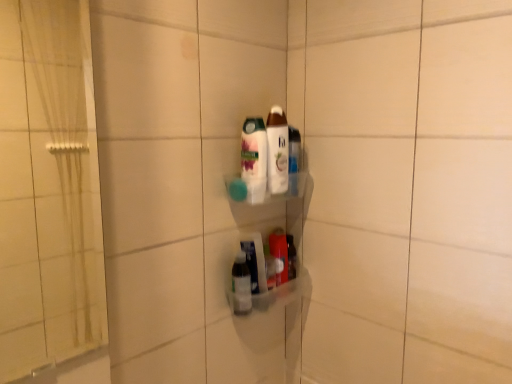
Find the location of a particular element. The image size is (512, 384). white glossy lotion at center, arranged as the 1th bottle when viewed from the top is located at coordinates (277, 151).

Identify the location of white glossy bottle at center, positioned as the third bottle in bottom-to-top order. (254, 159).

Between white glossy lotion at center, arranged as the 1th bottle when viewed from the top, and white glossy bottle at center, arranged as the second bottle when viewed from the top, which one has more height?

white glossy lotion at center, arranged as the 1th bottle when viewed from the top, is taller.

Choose the correct answer: Is white glossy lotion at center, the 4th bottle when ordered from bottom to top, inside white glossy bottle at center, positioned as the third bottle in bottom-to-top order, or outside it?

white glossy lotion at center, the 4th bottle when ordered from bottom to top, cannot be found inside white glossy bottle at center, positioned as the third bottle in bottom-to-top order.

Is white glossy lotion at center, arranged as the 1th bottle when viewed from the top, in front of or behind white glossy bottle at center, arranged as the second bottle when viewed from the top, in the image?

In the image, white glossy lotion at center, arranged as the 1th bottle when viewed from the top, appears behind white glossy bottle at center, arranged as the second bottle when viewed from the top.

Do you think white glossy lotion at center, the 4th bottle when ordered from bottom to top, is within translucent plastic bottle at lower center, the 3th bottle in the top-to-bottom sequence, or outside of it?

white glossy lotion at center, the 4th bottle when ordered from bottom to top, cannot be found inside translucent plastic bottle at lower center, the 3th bottle in the top-to-bottom sequence.

Is the surface of white glossy lotion at center, the 4th bottle when ordered from bottom to top, in direct contact with translucent plastic bottle at lower center, which appears as the 2th bottle when ordered from the bottom?

white glossy lotion at center, the 4th bottle when ordered from bottom to top, and translucent plastic bottle at lower center, which appears as the 2th bottle when ordered from the bottom, are clearly separated.

Which object is wider, white glossy lotion at center, the 4th bottle when ordered from bottom to top, or translucent plastic bottle at lower center, which appears as the 2th bottle when ordered from the bottom?

With larger width is translucent plastic bottle at lower center, which appears as the 2th bottle when ordered from the bottom.

From the picture: Can you confirm if white glossy lotion at center, the 4th bottle when ordered from bottom to top, is bigger than translucent plastic bottle at lower center, which appears as the 2th bottle when ordered from the bottom?

Yes, white glossy lotion at center, the 4th bottle when ordered from bottom to top, is bigger than translucent plastic bottle at lower center, which appears as the 2th bottle when ordered from the bottom.

Considering the relative sizes of translucent plastic bottle at lower center, which appears as the 2th bottle when ordered from the bottom, and translucent plastic bottle at center, the first bottle in the bottom-to-top sequence, in the image provided, is translucent plastic bottle at lower center, which appears as the 2th bottle when ordered from the bottom, bigger than translucent plastic bottle at center, the first bottle in the bottom-to-top sequence,?

Indeed, translucent plastic bottle at lower center, which appears as the 2th bottle when ordered from the bottom, has a larger size compared to translucent plastic bottle at center, the first bottle in the bottom-to-top sequence.

Between translucent plastic bottle at lower center, which appears as the 2th bottle when ordered from the bottom, and translucent plastic bottle at center, the first bottle in the bottom-to-top sequence, which one is positioned in front?

translucent plastic bottle at center, the first bottle in the bottom-to-top sequence.

How many degrees apart are the facing directions of translucent plastic bottle at lower center, the 3th bottle in the top-to-bottom sequence, and translucent plastic bottle at center, the first bottle in the bottom-to-top sequence?

translucent plastic bottle at lower center, the 3th bottle in the top-to-bottom sequence, and translucent plastic bottle at center, the first bottle in the bottom-to-top sequence, are facing 0.00428 degrees away from each other.

Is white glossy bottle at center, positioned as the third bottle in bottom-to-top order, inside translucent plastic bottle at center, the first bottle in the bottom-to-top sequence?

No, white glossy bottle at center, positioned as the third bottle in bottom-to-top order, is located outside of translucent plastic bottle at center, the first bottle in the bottom-to-top sequence.

Considering the relative sizes of translucent plastic bottle at center, which ranks as the 4th bottle in top-to-bottom order, and white glossy bottle at center, arranged as the second bottle when viewed from the top, in the image provided, is translucent plastic bottle at center, which ranks as the 4th bottle in top-to-bottom order, smaller than white glossy bottle at center, arranged as the second bottle when viewed from the top,?

Correct, translucent plastic bottle at center, which ranks as the 4th bottle in top-to-bottom order, occupies less space than white glossy bottle at center, arranged as the second bottle when viewed from the top.

Is translucent plastic bottle at center, which ranks as the 4th bottle in top-to-bottom order, shorter than white glossy bottle at center, arranged as the second bottle when viewed from the top?

Yes.

Is point (247, 281) closer to camera compared to point (257, 152)?

No, (247, 281) is further to viewer.

From the image's perspective, is white glossy bottle at center, arranged as the second bottle when viewed from the top, under translucent plastic bottle at lower center, the 3th bottle in the top-to-bottom sequence?

No, from the image's perspective, white glossy bottle at center, arranged as the second bottle when viewed from the top, is not beneath translucent plastic bottle at lower center, the 3th bottle in the top-to-bottom sequence.

Between point (256, 151) and point (276, 233), which one is positioned in front?

The point (256, 151) is in front.

Based on the photo, which is more to the right, white glossy bottle at center, arranged as the second bottle when viewed from the top, or translucent plastic bottle at lower center, which appears as the 2th bottle when ordered from the bottom?

From the viewer's perspective, translucent plastic bottle at lower center, which appears as the 2th bottle when ordered from the bottom, appears more on the right side.

Based on the photo, is white glossy bottle at center, arranged as the second bottle when viewed from the top, wider than translucent plastic bottle at lower center, which appears as the 2th bottle when ordered from the bottom?

Yes.

Considering the sizes of objects white glossy lotion at center, arranged as the 1th bottle when viewed from the top, and translucent plastic bottle at center, the first bottle in the bottom-to-top sequence, in the image provided, who is thinner, white glossy lotion at center, arranged as the 1th bottle when viewed from the top, or translucent plastic bottle at center, the first bottle in the bottom-to-top sequence,?

Thinner between the two is white glossy lotion at center, arranged as the 1th bottle when viewed from the top.

Which object is closer to the camera, white glossy lotion at center, the 4th bottle when ordered from bottom to top, or translucent plastic bottle at center, which ranks as the 4th bottle in top-to-bottom order?

white glossy lotion at center, the 4th bottle when ordered from bottom to top.

Looking at this image, from the image's perspective, between white glossy lotion at center, the 4th bottle when ordered from bottom to top, and translucent plastic bottle at center, the first bottle in the bottom-to-top sequence, who is located below?

translucent plastic bottle at center, the first bottle in the bottom-to-top sequence.

The width and height of the screenshot is (512, 384). In order to click on the 2nd bottle to the right of the translucent plastic bottle at center, which ranks as the 4th bottle in top-to-bottom order, counting from the anchor's position in this screenshot , I will do 277,151.

From the image's perspective, is white glossy bottle at center, arranged as the second bottle when viewed from the top, positioned above or below white glossy lotion at center, arranged as the 1th bottle when viewed from the top?

white glossy bottle at center, arranged as the second bottle when viewed from the top, is below white glossy lotion at center, arranged as the 1th bottle when viewed from the top.

Is point (253, 172) closer or farther from the camera than point (269, 191)?

Point (253, 172) is positioned closer to the camera compared to point (269, 191).

Is white glossy bottle at center, positioned as the third bottle in bottom-to-top order, far away from white glossy lotion at center, the 4th bottle when ordered from bottom to top?

That's not correct — white glossy bottle at center, positioned as the third bottle in bottom-to-top order, is a little close to white glossy lotion at center, the 4th bottle when ordered from bottom to top.

Consider the image. Choose the correct answer: Is white glossy bottle at center, arranged as the second bottle when viewed from the top, inside white glossy lotion at center, the 4th bottle when ordered from bottom to top, or outside it?

The correct answer is: outside.

From a real-world perspective, count 1st bottles downward from the white glossy lotion at center, the 4th bottle when ordered from bottom to top, and point to it. Please provide its 2D coordinates.

[(254, 159)]

I want to click on bottle on the right of the white glossy lotion at center, the 4th bottle when ordered from bottom to top, so click(x=279, y=253).

Which object lies further to the anchor point white glossy bottle at center, arranged as the second bottle when viewed from the top, translucent plastic bottle at center, the first bottle in the bottom-to-top sequence, or translucent plastic bottle at lower center, which appears as the 2th bottle when ordered from the bottom?

The object further to white glossy bottle at center, arranged as the second bottle when viewed from the top, is translucent plastic bottle at lower center, which appears as the 2th bottle when ordered from the bottom.

Based on their spatial positions, is translucent plastic bottle at center, which ranks as the 4th bottle in top-to-bottom order, or white glossy lotion at center, arranged as the 1th bottle when viewed from the top, further from white glossy bottle at center, arranged as the second bottle when viewed from the top?

The object further to white glossy bottle at center, arranged as the second bottle when viewed from the top, is translucent plastic bottle at center, which ranks as the 4th bottle in top-to-bottom order.

Considering their positions, is translucent plastic bottle at lower center, which appears as the 2th bottle when ordered from the bottom, positioned closer to white glossy bottle at center, arranged as the second bottle when viewed from the top, than translucent plastic bottle at center, the first bottle in the bottom-to-top sequence?

Among the two, translucent plastic bottle at center, the first bottle in the bottom-to-top sequence, is located nearer to white glossy bottle at center, arranged as the second bottle when viewed from the top.

When comparing their distances from white glossy bottle at center, arranged as the second bottle when viewed from the top, does white glossy lotion at center, arranged as the 1th bottle when viewed from the top, or translucent plastic bottle at lower center, the 3th bottle in the top-to-bottom sequence, seem closer?

Among the two, white glossy lotion at center, arranged as the 1th bottle when viewed from the top, is located nearer to white glossy bottle at center, arranged as the second bottle when viewed from the top.

Considering their positions, is white glossy lotion at center, arranged as the 1th bottle when viewed from the top, positioned further to translucent plastic bottle at center, the first bottle in the bottom-to-top sequence, than translucent plastic bottle at lower center, the 3th bottle in the top-to-bottom sequence?

white glossy lotion at center, arranged as the 1th bottle when viewed from the top.

Considering their positions, is translucent plastic bottle at center, which ranks as the 4th bottle in top-to-bottom order, positioned closer to translucent plastic bottle at lower center, the 3th bottle in the top-to-bottom sequence, than white glossy bottle at center, positioned as the third bottle in bottom-to-top order?

Among the two, translucent plastic bottle at center, which ranks as the 4th bottle in top-to-bottom order, is located nearer to translucent plastic bottle at lower center, the 3th bottle in the top-to-bottom sequence.

When comparing their distances from white glossy lotion at center, arranged as the 1th bottle when viewed from the top, does translucent plastic bottle at lower center, the 3th bottle in the top-to-bottom sequence, or white glossy bottle at center, arranged as the second bottle when viewed from the top, seem further?

translucent plastic bottle at lower center, the 3th bottle in the top-to-bottom sequence, is further to white glossy lotion at center, arranged as the 1th bottle when viewed from the top.

Looking at the image, which one is located closer to white glossy lotion at center, arranged as the 1th bottle when viewed from the top, translucent plastic bottle at center, the first bottle in the bottom-to-top sequence, or translucent plastic bottle at lower center, the 3th bottle in the top-to-bottom sequence?

translucent plastic bottle at lower center, the 3th bottle in the top-to-bottom sequence, is positioned closer to the anchor white glossy lotion at center, arranged as the 1th bottle when viewed from the top.

Where is `bottle between white glossy lotion at center, the 4th bottle when ordered from bottom to top, and translucent plastic bottle at lower center, which appears as the 2th bottle when ordered from the bottom, in the up-down direction`? This screenshot has width=512, height=384. bottle between white glossy lotion at center, the 4th bottle when ordered from bottom to top, and translucent plastic bottle at lower center, which appears as the 2th bottle when ordered from the bottom, in the up-down direction is located at coordinates (254, 159).

Identify the location of bottle that lies between white glossy bottle at center, positioned as the third bottle in bottom-to-top order, and translucent plastic bottle at center, which ranks as the 4th bottle in top-to-bottom order, from top to bottom. (279, 253).